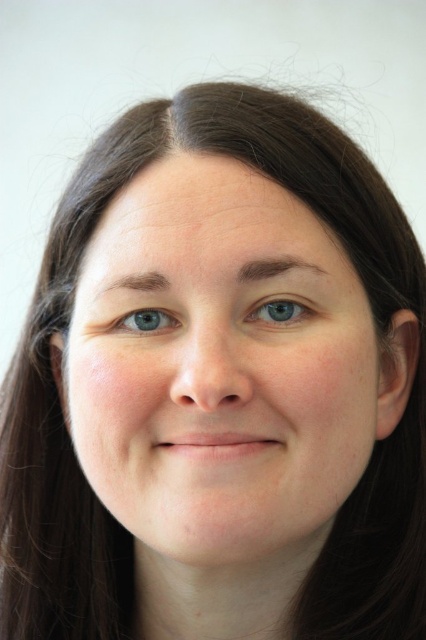
From the picture: Does blue matte eye at center have a smaller size compared to blue smooth eye at center?

Correct, blue matte eye at center occupies less space than blue smooth eye at center.

Which is more to the left, blue matte eye at center or blue smooth eye at center?

Positioned to the left is blue smooth eye at center.

Who is more forward, (310, 312) or (124, 330)?

Point (310, 312) is in front.

The width and height of the screenshot is (426, 640). Find the location of `blue matte eye at center`. blue matte eye at center is located at coordinates (279, 312).